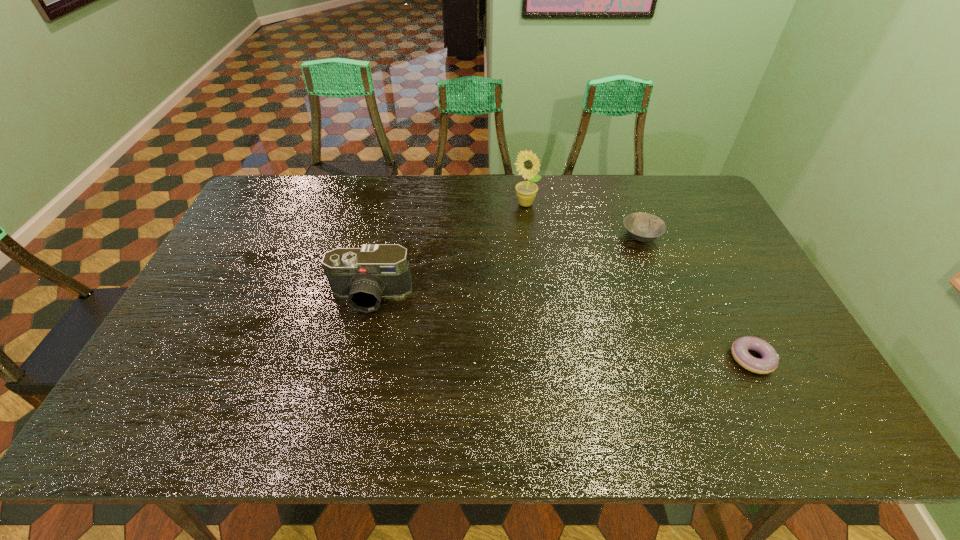
I want to click on free spot located on the left of the second shortest object, so click(x=554, y=236).

At what (x,y) coordinates should I click in order to perform the action: click on free spot located 0.390m on the back of the nearest object. Please return your answer as a coordinate pair (x, y). This screenshot has width=960, height=540. Looking at the image, I should click on (692, 240).

At what (x,y) coordinates should I click in order to perform the action: click on object positioned at the far edge. Please return your answer as a coordinate pair (x, y). Image resolution: width=960 pixels, height=540 pixels. Looking at the image, I should click on (527, 164).

At what (x,y) coordinates should I click in order to perform the action: click on object that is positioned at the right edge. Please return your answer as a coordinate pair (x, y). This screenshot has height=540, width=960. Looking at the image, I should click on (769, 362).

Where is `vacant region at the far edge of the desktop`? vacant region at the far edge of the desktop is located at coordinates (470, 180).

The image size is (960, 540). Find the location of `vacant area at the near edge`. vacant area at the near edge is located at coordinates (546, 418).

In the image, there is a desktop. At what (x,y) coordinates should I click in order to perform the action: click on vacant space at the left edge. Please return your answer as a coordinate pair (x, y). The image size is (960, 540). Looking at the image, I should click on (251, 293).

Where is `free spot at the right edge of the desktop`? The image size is (960, 540). free spot at the right edge of the desktop is located at coordinates (x=738, y=252).

Image resolution: width=960 pixels, height=540 pixels. I want to click on free space at the far right corner of the desktop, so click(x=654, y=180).

This screenshot has width=960, height=540. I want to click on free space between the bowl and the second object from left to right, so click(x=583, y=220).